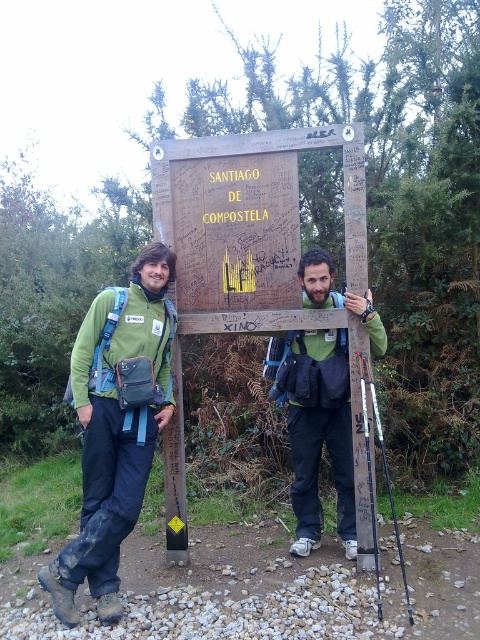
Question: Can you confirm if green fabric backpack at center is positioned above green matte jacket at center?

Choices:
 (A) yes
 (B) no

Answer: (B)

Question: Which of the following is the closest to the observer?

Choices:
 (A) (381, 429)
 (B) (343, 440)
 (C) (117, 339)
 (D) (368, 328)

Answer: (A)

Question: Observing the image, what is the correct spatial positioning of green fabric jacket at left in reference to black plastic ski pole at right?

Choices:
 (A) left
 (B) right

Answer: (A)

Question: Is green fabric backpack at center bigger than black plastic ski pole at right?

Choices:
 (A) yes
 (B) no

Answer: (A)

Question: Among these objects, which one is nearest to the camera?

Choices:
 (A) green fabric backpack at center
 (B) black plastic ski pole at right

Answer: (B)

Question: Which point is closer to the camera?

Choices:
 (A) (365, 420)
 (B) (109, 518)
 (C) (117, 616)

Answer: (C)